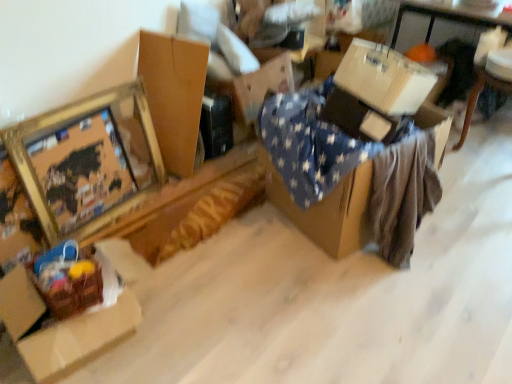
Question: From the image's perspective, is white cardboard box at upper right, which is counted as the 1th table, starting from the back, positioned above or below gold metallic picture frame at upper left?

Choices:
 (A) below
 (B) above

Answer: (B)

Question: Which is correct: white cardboard box at upper right, the 1th table when ordered from right to left, is inside gold metallic picture frame at upper left, or outside of it?

Choices:
 (A) inside
 (B) outside

Answer: (B)

Question: Which of these objects is positioned closest to the blue star-patterned fabric at center, positioned as the 2th table in back-to-front order?

Choices:
 (A) brown cardboard box at upper left, which is the 2th cardboard box from right to left
 (B) white cardboard box at upper right, which is counted as the 1th table, starting from the back
 (C) gold metallic picture frame at upper left
 (D) brown cardboard box at lower left, which is the first cardboard box from left to right
 (E) white corrugated cardboard box at upper right, acting as the third cardboard box starting from the left

Answer: (E)

Question: Estimate the real-world distances between objects in this image. Which object is closer to the white cardboard box at upper right, which is the 2th table in left-to-right order?

Choices:
 (A) gold metallic picture frame at upper left
 (B) blue star-patterned fabric at center, positioned as the 2th table in back-to-front order
 (C) white corrugated cardboard box at upper right, acting as the third cardboard box starting from the left
 (D) brown cardboard box at lower left, which is the first cardboard box from left to right
 (E) brown cardboard box at upper left, which is the second cardboard box in left-to-right order

Answer: (C)